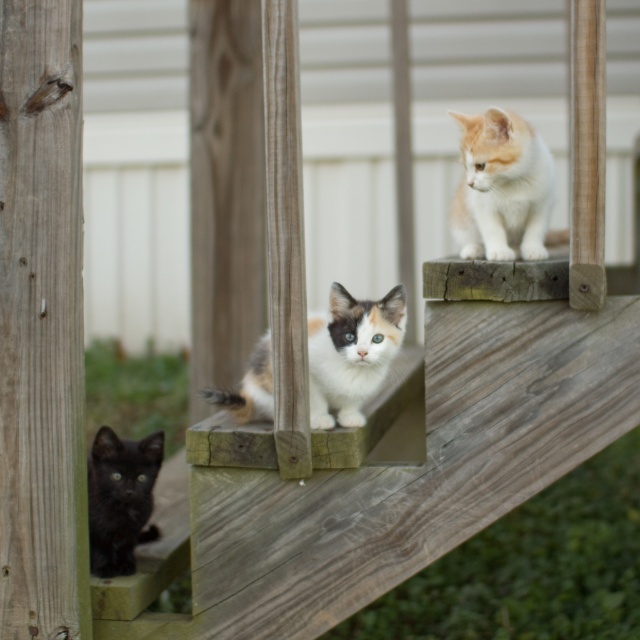
Who is positioned more to the right, orange and white fur cat at upper right or calico fur cat at center?

Positioned to the right is orange and white fur cat at upper right.

Is orange and white fur cat at upper right wider than calico fur cat at center?

No, orange and white fur cat at upper right is not wider than calico fur cat at center.

Identify the location of orange and white fur cat at upper right. The width and height of the screenshot is (640, 640). (502, 189).

This screenshot has height=640, width=640. In order to click on orange and white fur cat at upper right in this screenshot , I will do `click(502, 189)`.

Who is shorter, orange and white fur cat at upper right or shiny black kitten at lower left?

With less height is orange and white fur cat at upper right.

Does point (512, 184) come farther from viewer compared to point (125, 531)?

No, (512, 184) is in front of (125, 531).

Is point (513, 125) in front of point (132, 522)?

Yes, point (513, 125) is in front of point (132, 522).

The image size is (640, 640). I want to click on orange and white fur cat at upper right, so click(502, 189).

Is calico fur cat at center to the right of shiny black kitten at lower left from the viewer's perspective?

Indeed, calico fur cat at center is positioned on the right side of shiny black kitten at lower left.

Is point (260, 352) farther from camera compared to point (145, 490)?

That is False.

Does point (259, 372) come closer to viewer compared to point (104, 429)?

Yes, point (259, 372) is closer to viewer.

You are a GUI agent. You are given a task and a screenshot of the screen. Output one action in this format:
    pyautogui.click(x=<x>, y=<y>)
    Task: Click on the calico fur cat at center
    This screenshot has width=640, height=640.
    Given the screenshot: What is the action you would take?
    pyautogui.click(x=352, y=353)